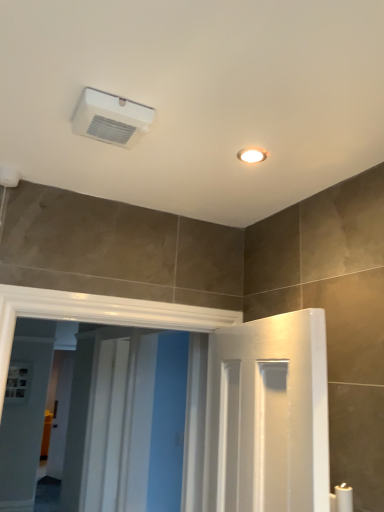
Question: Is white glossy screen door at center, arranged as the 1th screen door when viewed from the back, oriented towards white plastic air conditioning unit at upper center?

Choices:
 (A) yes
 (B) no

Answer: (B)

Question: Is white glossy screen door at center, arranged as the 1th screen door when viewed from the back, bigger than white plastic air conditioning unit at upper center?

Choices:
 (A) yes
 (B) no

Answer: (A)

Question: Can white plastic air conditioning unit at upper center be found inside white glossy screen door at center, arranged as the 2th screen door when viewed from the front?

Choices:
 (A) yes
 (B) no

Answer: (B)

Question: Does white glossy screen door at center, arranged as the 1th screen door when viewed from the back, appear on the right side of white plastic air conditioning unit at upper center?

Choices:
 (A) no
 (B) yes

Answer: (A)

Question: From a real-world perspective, is white glossy screen door at center, arranged as the 1th screen door when viewed from the back, physically below white plastic air conditioning unit at upper center?

Choices:
 (A) no
 (B) yes

Answer: (B)

Question: Considering the relative sizes of white glossy screen door at center, arranged as the 1th screen door when viewed from the back, and white plastic air conditioning unit at upper center in the image provided, is white glossy screen door at center, arranged as the 1th screen door when viewed from the back, wider than white plastic air conditioning unit at upper center?

Choices:
 (A) no
 (B) yes

Answer: (A)

Question: Is white glossy screen door at center, which ranks as the first screen door in front-to-back order, positioned with its back to white plastic air conditioning unit at upper center?

Choices:
 (A) yes
 (B) no

Answer: (B)

Question: From the image's perspective, would you say white glossy screen door at center, the 2th screen door in the back-to-front sequence, is shown under white plastic air conditioning unit at upper center?

Choices:
 (A) no
 (B) yes

Answer: (B)

Question: Can you see white glossy screen door at center, which ranks as the first screen door in front-to-back order, touching white plastic air conditioning unit at upper center?

Choices:
 (A) yes
 (B) no

Answer: (B)

Question: Can you confirm if white glossy screen door at center, which ranks as the first screen door in front-to-back order, is wider than white plastic air conditioning unit at upper center?

Choices:
 (A) yes
 (B) no

Answer: (A)

Question: Is the position of white glossy screen door at center, which ranks as the first screen door in front-to-back order, less distant than that of white plastic air conditioning unit at upper center?

Choices:
 (A) no
 (B) yes

Answer: (A)

Question: Can you confirm if white glossy screen door at center, which ranks as the first screen door in front-to-back order, is positioned to the right of white plastic air conditioning unit at upper center?

Choices:
 (A) yes
 (B) no

Answer: (B)

Question: Is the depth of white glossy screen door at center, arranged as the 1th screen door when viewed from the back, greater than that of white glossy screen door at center, the 2th screen door in the back-to-front sequence?

Choices:
 (A) no
 (B) yes

Answer: (B)